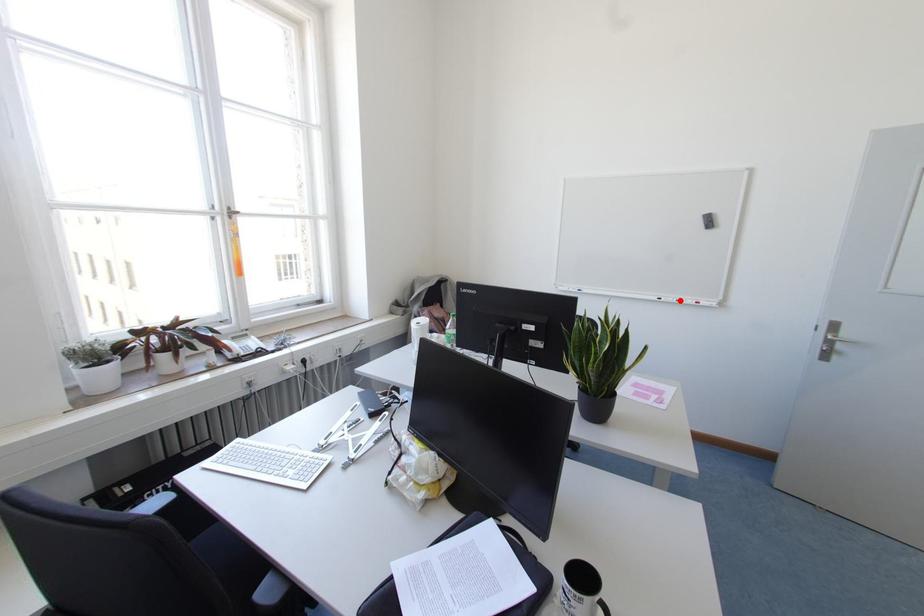
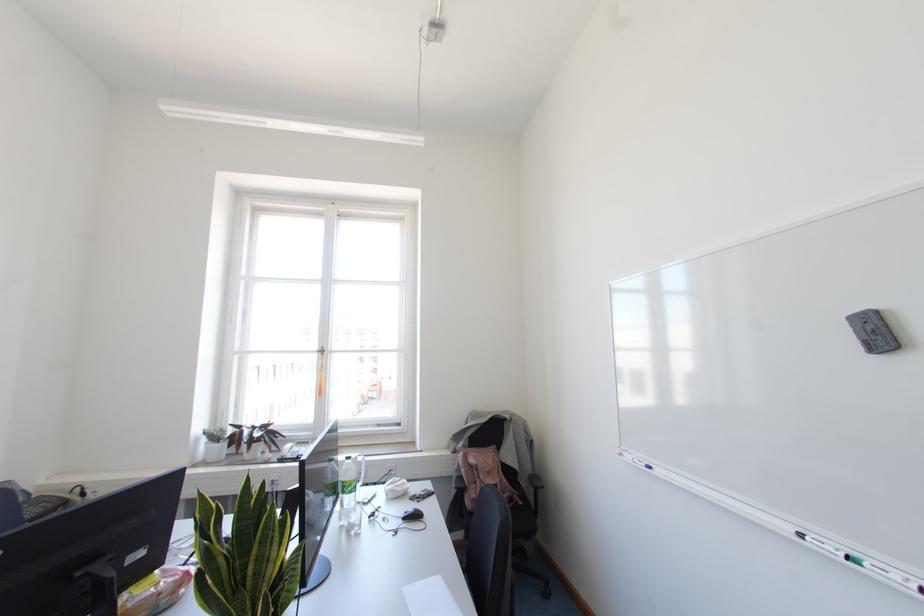
In the second image, find the point that corresponds to the highlighted location in the first image.

(866, 565)